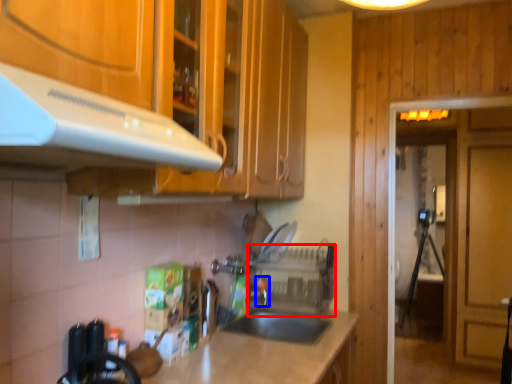
Question: Which of the following is the closest to the observer, appliance (highlighted by a red box) or faucet (highlighted by a blue box)?

Choices:
 (A) appliance
 (B) faucet

Answer: (A)